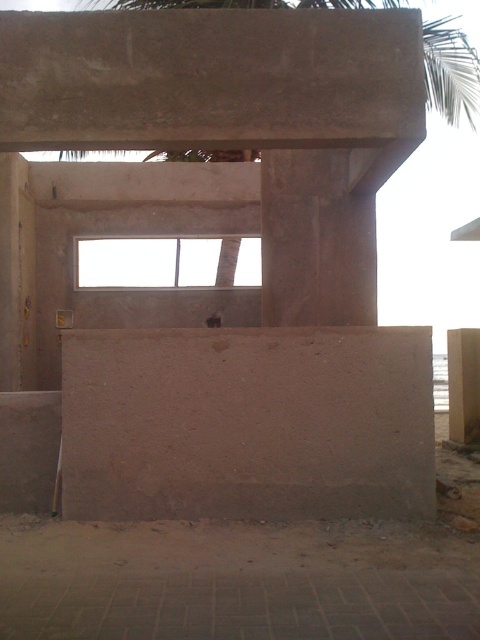
Question: Among these objects, which one is nearest to the camera?

Choices:
 (A) matte concrete window at center
 (B) brown concrete pillar at right

Answer: (B)

Question: Which of the following is the closest to the observer?

Choices:
 (A) (223, 266)
 (B) (469, 333)
 (C) (62, 156)
 (D) (178, 492)

Answer: (D)

Question: Where is smooth concrete wall at center located in relation to green leafy palm tree at upper center in the image?

Choices:
 (A) left
 (B) right

Answer: (A)

Question: Among these points, which one is nearest to the camera?

Choices:
 (A) (115, 499)
 (B) (202, 244)

Answer: (A)

Question: Can you confirm if matte concrete window at center is positioned below brown concrete pillar at right?

Choices:
 (A) yes
 (B) no

Answer: (B)

Question: Is green leafy palm tree at upper center positioned before matte concrete window at center?

Choices:
 (A) no
 (B) yes

Answer: (B)